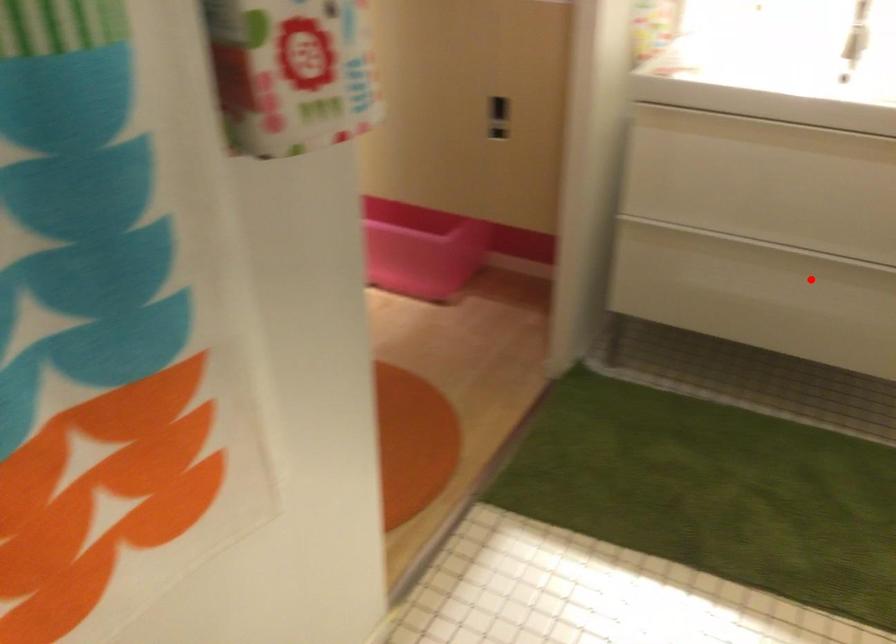
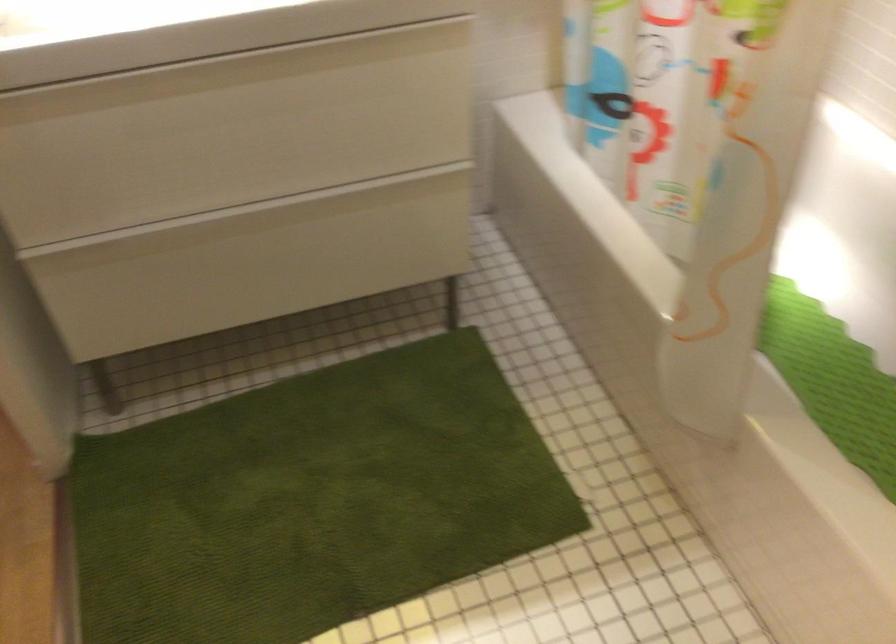
Question: I am providing you with two images of the same scene from different viewpoints. In image1, a red point is highlighted. Considering the same 3D point in image2, which of the following is correct?

Choices:
 (A) It is closer
 (B) It is farther

Answer: (A)